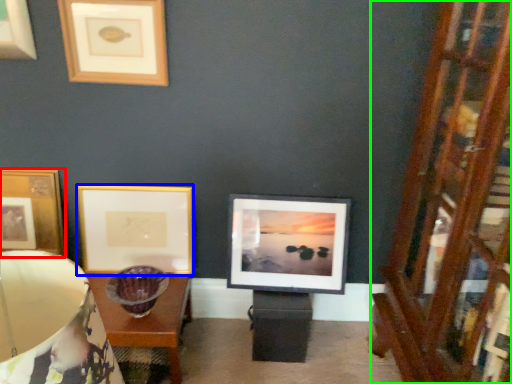
Question: Based on their relative distances, which object is nearer to picture frame (highlighted by a red box)? Choose from picture frame (highlighted by a blue box) and dresser (highlighted by a green box).

Choices:
 (A) picture frame
 (B) dresser

Answer: (A)